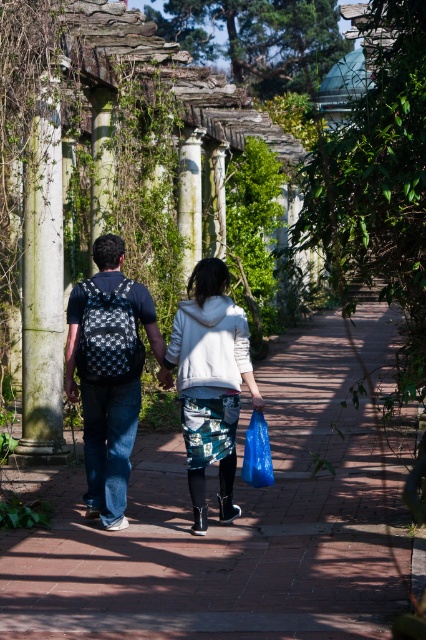
What do you see at coordinates (236, 525) in the screenshot? The height and width of the screenshot is (640, 426). I see `brick pavement at center` at bounding box center [236, 525].

Which is behind, point (46, 496) or point (40, 296)?

Point (40, 296)

Find the location of a particular element. brick pavement at center is located at coordinates (236, 525).

Is point (31, 545) positioned before point (259, 429)?

Yes, point (31, 545) is in front of point (259, 429).

Looking at this image, can you confirm if brick pavement at center is positioned to the right of blue plastic bag at center?

Yes, brick pavement at center is to the right of blue plastic bag at center.

At what (x,y) coordinates should I click in order to perform the action: click on brick pavement at center. Please return your answer as a coordinate pair (x, y). The image size is (426, 640). Looking at the image, I should click on (236, 525).

This screenshot has width=426, height=640. I want to click on brick pavement at center, so click(236, 525).

Can you confirm if white fleece jacket at center is taller than white stone column at left?

In fact, white fleece jacket at center may be shorter than white stone column at left.

Is white fleece jacket at center wider than white stone column at left?

Yes, white fleece jacket at center is wider than white stone column at left.

What do you see at coordinates (210, 381) in the screenshot? The width and height of the screenshot is (426, 640). I see `white fleece jacket at center` at bounding box center [210, 381].

At what (x,y) coordinates should I click in order to perform the action: click on white fleece jacket at center. Please return your answer as a coordinate pair (x, y). Looking at the image, I should click on (210, 381).